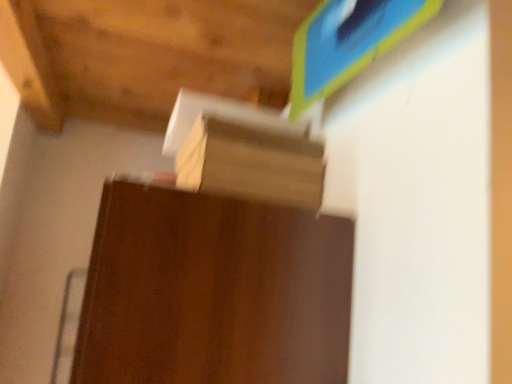
Question: Is dark wood table at center outside of brown cardboard at center?

Choices:
 (A) yes
 (B) no

Answer: (A)

Question: From a real-world perspective, is dark wood table at center located beneath brown cardboard at center?

Choices:
 (A) yes
 (B) no

Answer: (A)

Question: From the image's perspective, is dark wood table at center on top of brown cardboard at center?

Choices:
 (A) no
 (B) yes

Answer: (A)

Question: Does dark wood table at center appear on the left side of brown cardboard at center?

Choices:
 (A) no
 (B) yes

Answer: (B)

Question: Considering the relative sizes of dark wood table at center and brown cardboard at center in the image provided, is dark wood table at center bigger than brown cardboard at center?

Choices:
 (A) no
 (B) yes

Answer: (B)

Question: Is dark wood table at center shorter than brown cardboard at center?

Choices:
 (A) no
 (B) yes

Answer: (A)

Question: Considering the relative sizes of brown cardboard at center and dark wood table at center in the image provided, is brown cardboard at center shorter than dark wood table at center?

Choices:
 (A) yes
 (B) no

Answer: (A)

Question: Does brown cardboard at center lie behind dark wood table at center?

Choices:
 (A) yes
 (B) no

Answer: (A)

Question: Could dark wood table at center be considered to be inside brown cardboard at center?

Choices:
 (A) yes
 (B) no

Answer: (B)

Question: Considering the relative positions of brown cardboard at center and dark wood table at center in the image provided, is brown cardboard at center to the right of dark wood table at center from the viewer's perspective?

Choices:
 (A) no
 (B) yes

Answer: (B)

Question: From a real-world perspective, is brown cardboard at center physically below dark wood table at center?

Choices:
 (A) yes
 (B) no

Answer: (B)

Question: Does brown cardboard at center have a lesser width compared to dark wood table at center?

Choices:
 (A) no
 (B) yes

Answer: (B)

Question: Does point (284, 223) appear closer or farther from the camera than point (241, 129)?

Choices:
 (A) farther
 (B) closer

Answer: (B)